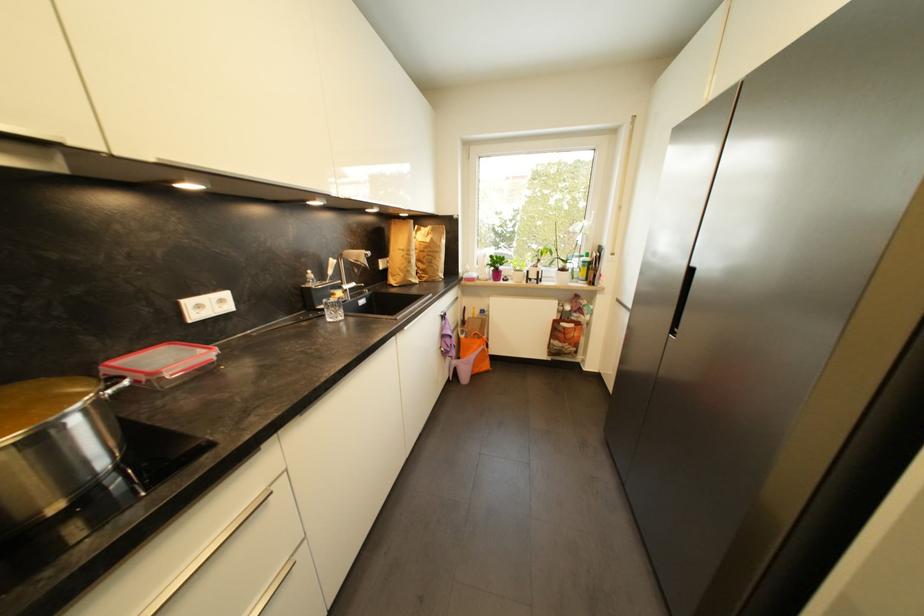
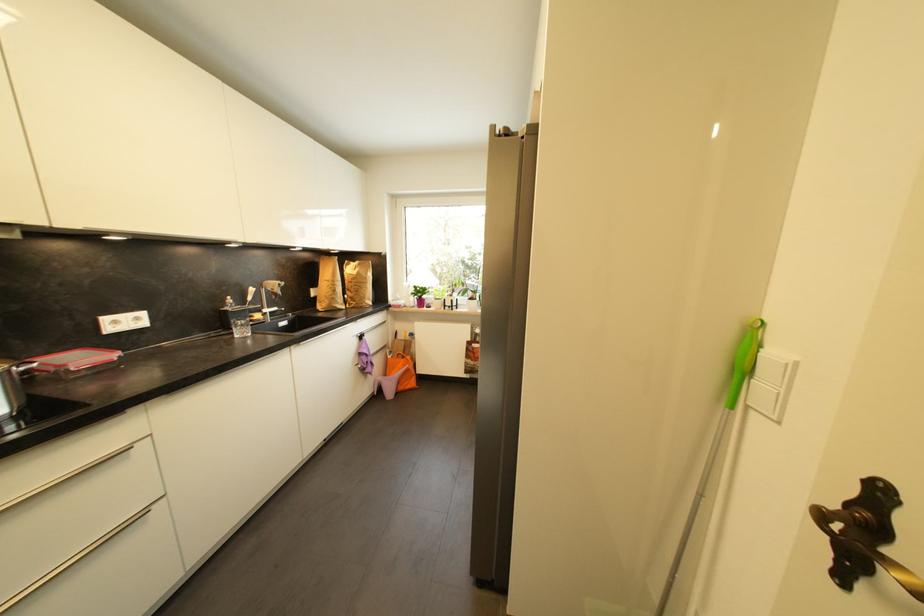
What movement of the cameraman would produce the second image?

The cameraman walked toward right, backward.